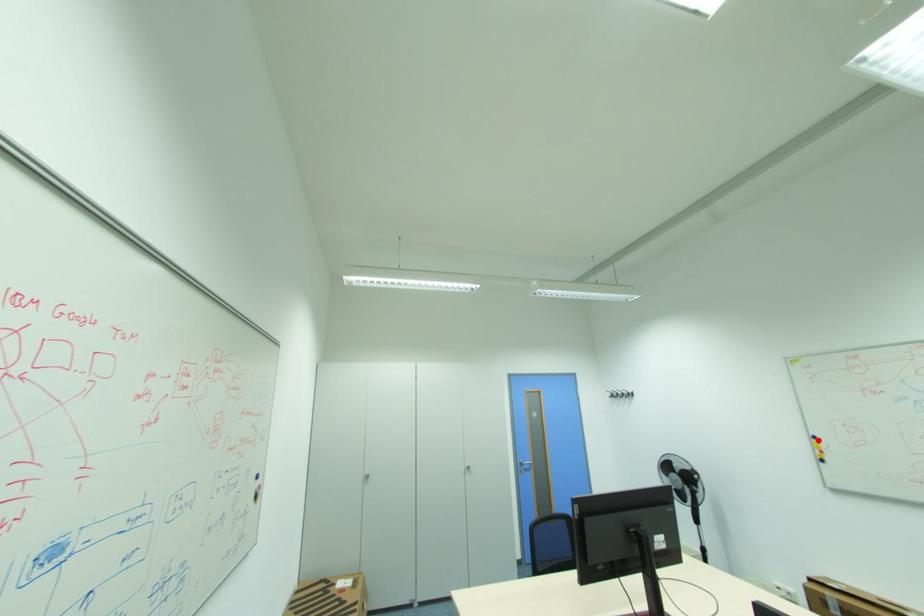
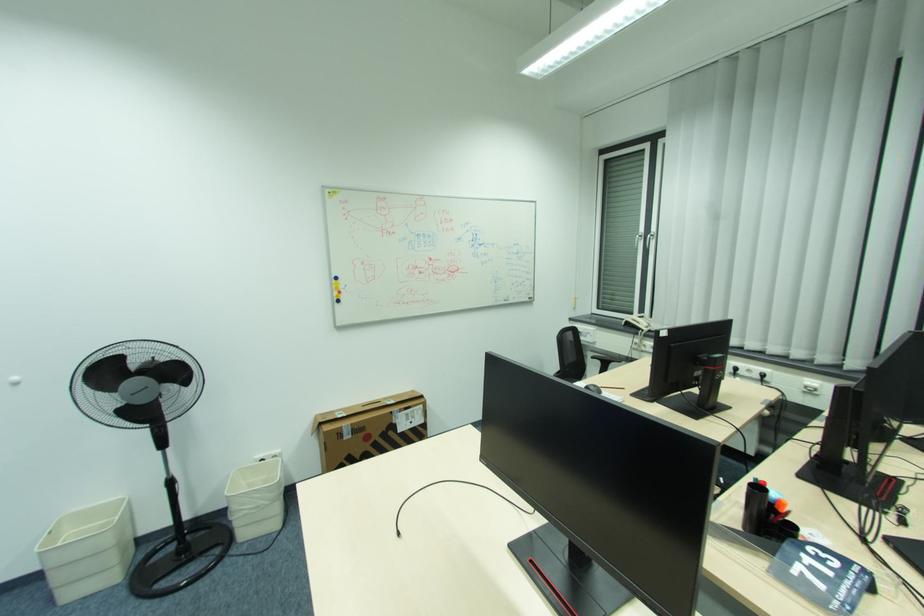
In the second image, find the point that corresponds to the highlighted location in the first image.

(339, 282)